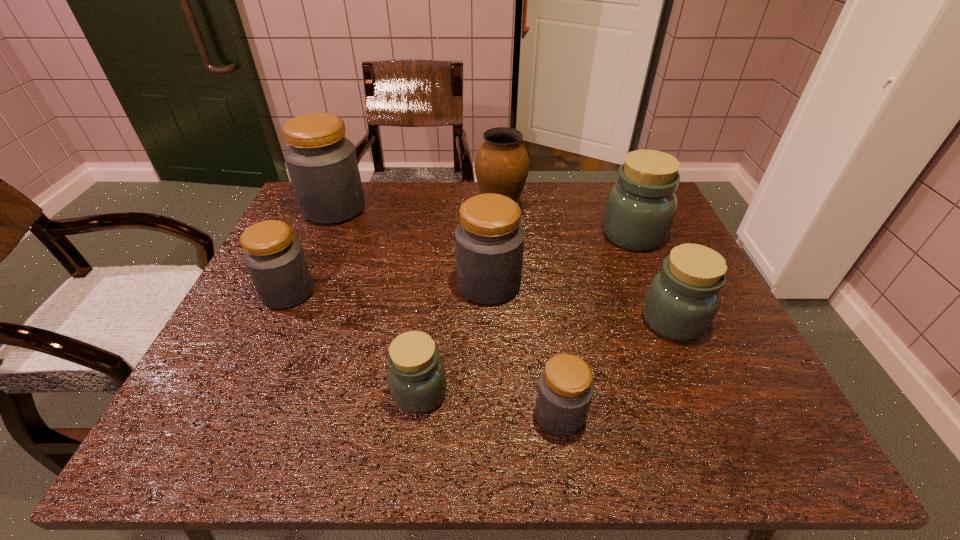
Find the location of a particular element. free space that satisfies the following two spatial constraints: 1. on the surface of the biggest gray jar near the warning symbol; 2. on the left side of the brown urn is located at coordinates (333, 212).

In order to click on vacant space that satisfies the following two spatial constraints: 1. on the surface of the second smallest green jar near the warning symbol; 2. on the left side of the farthest gray jar in this screenshot , I will do `click(285, 321)`.

Locate an element on the screen. vacant position in the image that satisfies the following two spatial constraints: 1. on the front side of the farthest green jar; 2. on the left side of the second farthest green jar is located at coordinates (670, 321).

Locate an element on the screen. vacant space that satisfies the following two spatial constraints: 1. on the surface of the farthest gray jar near the warning symbol; 2. on the back side of the third jar from left to right is located at coordinates (253, 393).

What are the coordinates of `free space that satisfies the following two spatial constraints: 1. on the surface of the third biggest gray jar near the warning symbol; 2. on the left side of the second smallest green jar` in the screenshot? It's located at (275, 321).

You are a GUI agent. You are given a task and a screenshot of the screen. Output one action in this format:
    pyautogui.click(x=<x>, y=<y>)
    Task: Click on the vacant area in the image that satisfies the following two spatial constraints: 1. on the surface of the biggest green jar near the warning symbol; 2. on the left side of the farthest gray jar
    The height and width of the screenshot is (540, 960).
    Given the screenshot: What is the action you would take?
    pyautogui.click(x=323, y=234)

In order to click on vacant space that satisfies the following two spatial constraints: 1. on the surface of the nearest green jar near the warning symbol; 2. on the right side of the tallest jar in this screenshot , I will do `click(253, 393)`.